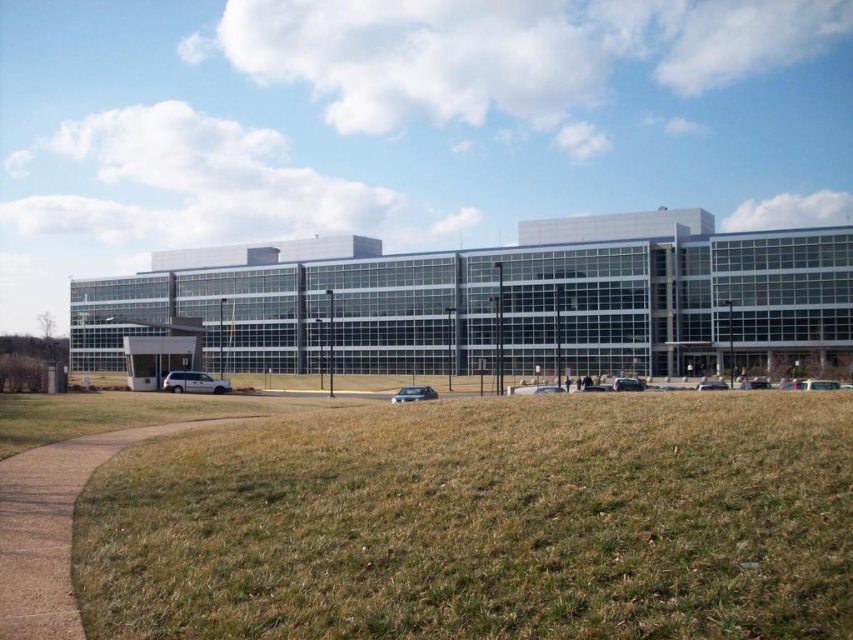
You are standing in front of the modern building and want to determine the relative positions of two points on the grassy area. Which point, point (277, 556) or point (422, 396), is closer to you?

Point (277, 556) is closer to the viewer than point (422, 396).

You are a landscape architect planning to replace the brown dry grass at lower left and the satin silver sedan at center with new plants. If you want to use the same amount of soil for both areas, which area requires more soil? Please explain your reasoning.

The satin silver sedan at center requires more soil because the brown dry grass at lower left occupies less space than the satin silver sedan at center, meaning the area for the sedan needs more soil to cover its larger space.

You are standing at the origin point of the coordinate system. You want to walk to the transparent glass building at center. In which direction should you walk?

The transparent glass building at center is located at coordinate point 0.472 on the x axis and 0.579 on the y axis. Since you are at the origin point, you should walk in the positive x and positive y direction to reach it.